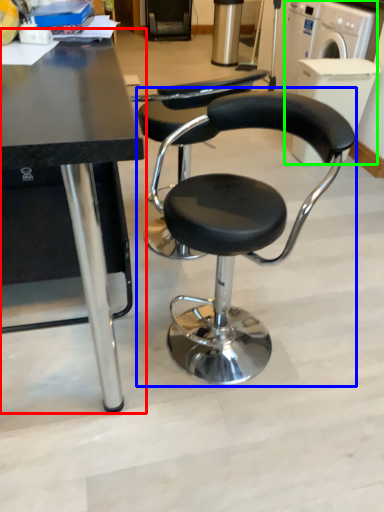
Question: Estimate the real-world distances between objects in this image. Which object is closer to table (highlighted by a red box), chair (highlighted by a blue box) or washing machine (highlighted by a green box)?

Choices:
 (A) chair
 (B) washing machine

Answer: (A)